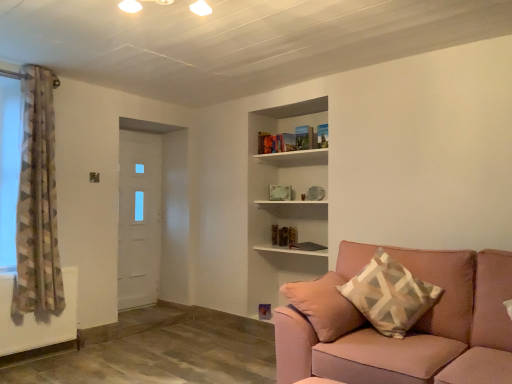
Question: Considering the relative sizes of white matte door at left and pink fabric couch at lower right in the image provided, is white matte door at left smaller than pink fabric couch at lower right?

Choices:
 (A) no
 (B) yes

Answer: (B)

Question: Is white matte door at left thinner than pink fabric couch at lower right?

Choices:
 (A) yes
 (B) no

Answer: (A)

Question: Is white matte door at left to the right of pink fabric couch at lower right from the viewer's perspective?

Choices:
 (A) no
 (B) yes

Answer: (A)

Question: From a real-world perspective, is white matte door at left over pink fabric couch at lower right?

Choices:
 (A) yes
 (B) no

Answer: (A)

Question: Does white matte door at left have a larger size compared to pink fabric couch at lower right?

Choices:
 (A) yes
 (B) no

Answer: (B)

Question: Is white wooden shelf at upper center to the left or to the right of geometric-patterned fabric curtain at left in the image?

Choices:
 (A) right
 (B) left

Answer: (A)

Question: From the image's perspective, is white wooden shelf at upper center above or below geometric-patterned fabric curtain at left?

Choices:
 (A) above
 (B) below

Answer: (A)

Question: In the image, is white wooden shelf at upper center positioned in front of or behind geometric-patterned fabric curtain at left?

Choices:
 (A) front
 (B) behind

Answer: (B)

Question: Considering the positions of white wooden shelf at upper center and geometric-patterned fabric curtain at left in the image, is white wooden shelf at upper center taller or shorter than geometric-patterned fabric curtain at left?

Choices:
 (A) short
 (B) tall

Answer: (A)

Question: In terms of width, does white matte door at left look wider or thinner when compared to beige geometric-patterned pillow at right?

Choices:
 (A) wide
 (B) thin

Answer: (B)

Question: Is white matte door at left to the left or to the right of beige geometric-patterned pillow at right in the image?

Choices:
 (A) left
 (B) right

Answer: (A)

Question: Would you say white matte door at left is inside or outside beige geometric-patterned pillow at right?

Choices:
 (A) inside
 (B) outside

Answer: (B)

Question: Looking at the image, does white matte door at left seem bigger or smaller compared to beige geometric-patterned pillow at right?

Choices:
 (A) small
 (B) big

Answer: (A)

Question: From the image's perspective, is pink fabric couch at lower right positioned above or below white matte door at left?

Choices:
 (A) above
 (B) below

Answer: (B)

Question: In the image, is pink fabric couch at lower right on the left side or the right side of white matte door at left?

Choices:
 (A) right
 (B) left

Answer: (A)